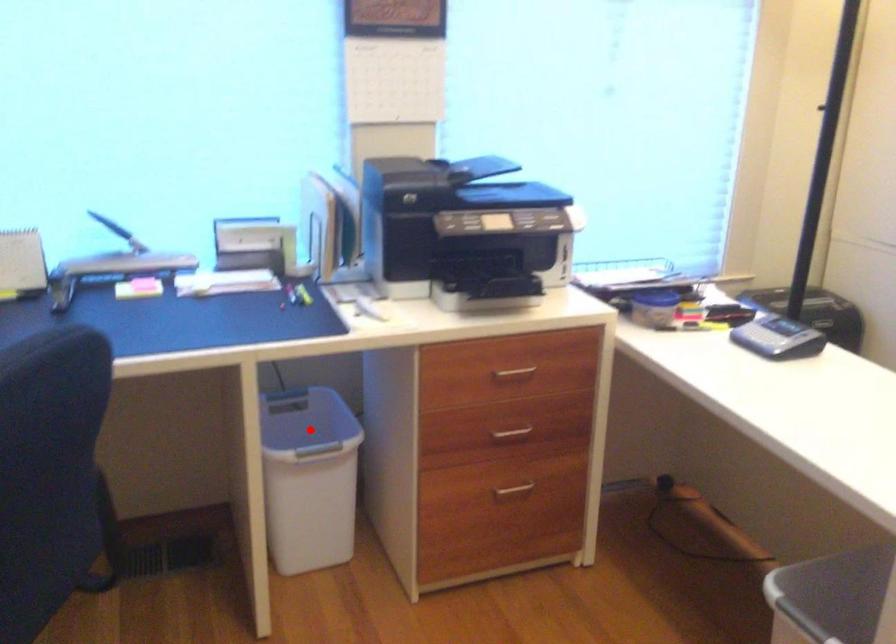
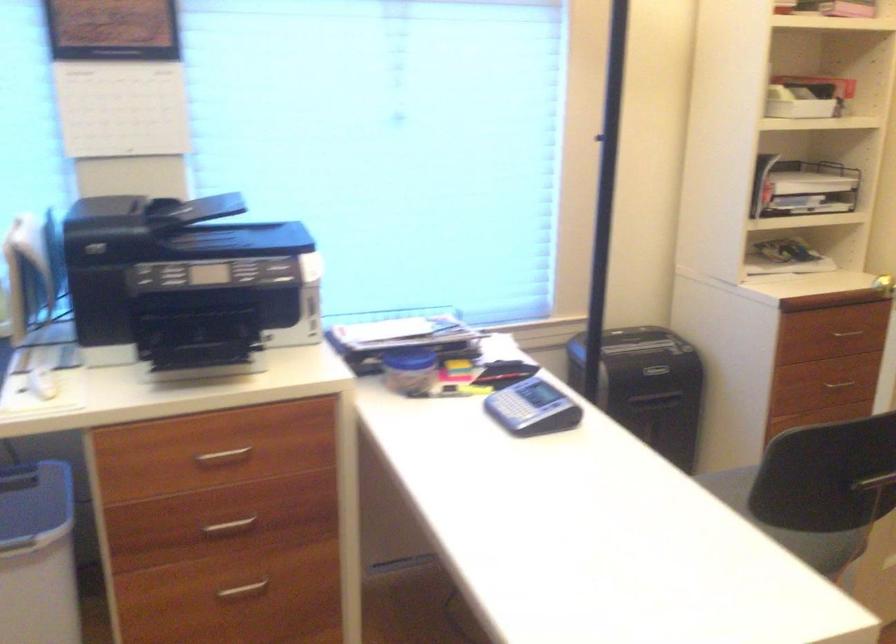
Question: I am providing you with two images of the same scene from different viewpoints. Given a red point in image1, look at the same physical point in image2. Is it:

Choices:
 (A) Closer to the viewpoint
 (B) Farther from the viewpoint

Answer: (A)